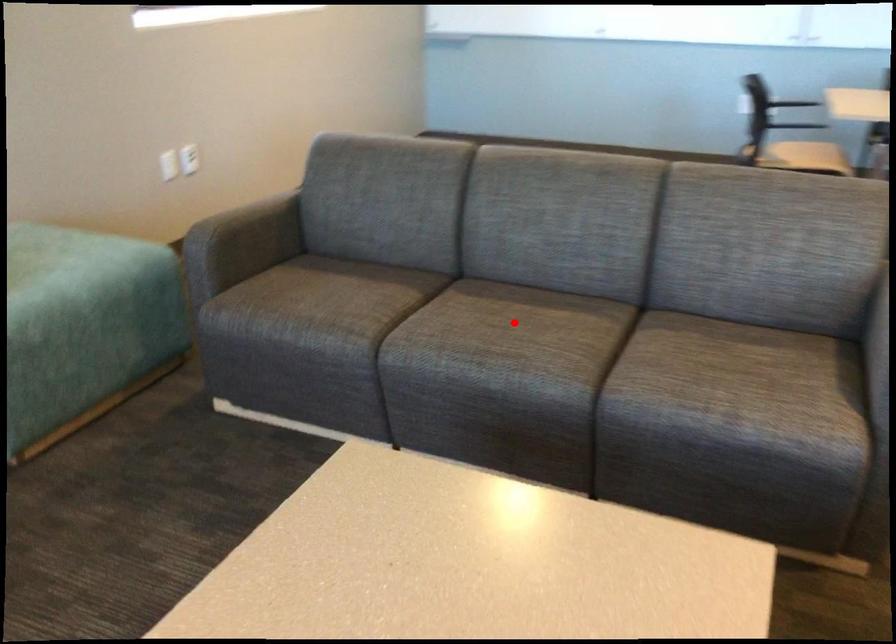
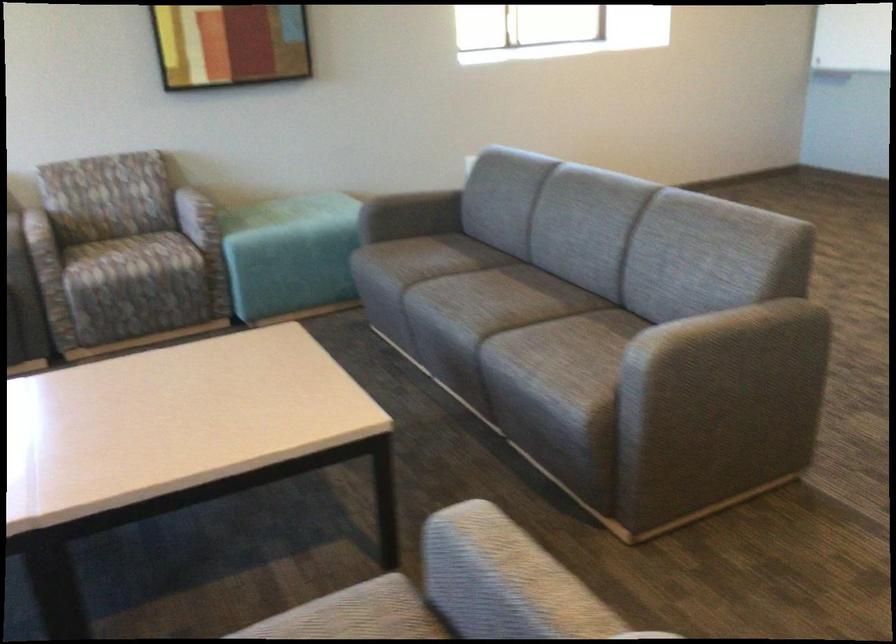
Question: I am providing you with two images of the same scene from different viewpoints. Image1 has a red point marked. In image2, the corresponding 3D location appears at what relative position? Reply with the corresponding letter.

Choices:
 (A) Closer
 (B) Farther

Answer: (B)